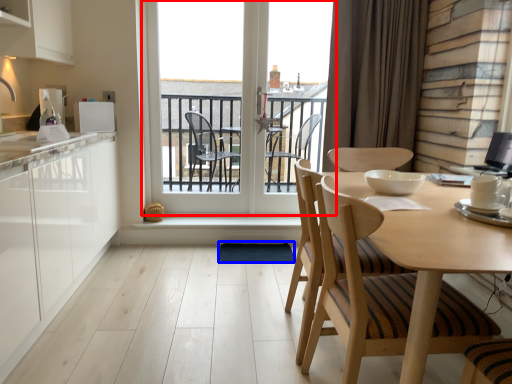
Question: Which point is closer to the camera, window (highlighted by a red box) or wide (highlighted by a blue box)?

Choices:
 (A) window
 (B) wide

Answer: (B)